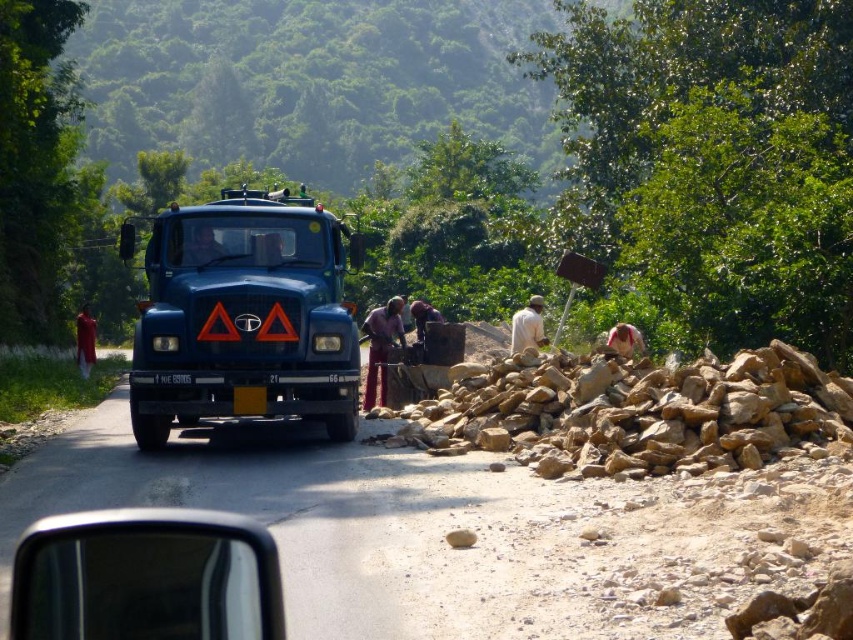
Question: Considering the real-world distances, which object is closest to the blue metallic truck at center?

Choices:
 (A) dark blue shirt at center
 (B) white fabric shirt at center
 (C) matte black truck at center

Answer: (C)

Question: Among these points, which one is farthest from the camera?

Choices:
 (A) (201, 269)
 (B) (390, 323)
 (C) (412, 436)

Answer: (B)

Question: Which point is closer to the camera taking this photo?

Choices:
 (A) (527, 323)
 (B) (619, 336)

Answer: (B)

Question: Can you confirm if matte blue truck at center is positioned to the right of matte black truck at center?

Choices:
 (A) yes
 (B) no

Answer: (A)

Question: From the image, what is the correct spatial relationship of matte blue truck at center in relation to blue metallic truck at center?

Choices:
 (A) below
 (B) above

Answer: (A)

Question: Is white fabric shirt at center thinner than brown fabric shirt at right?

Choices:
 (A) yes
 (B) no

Answer: (B)